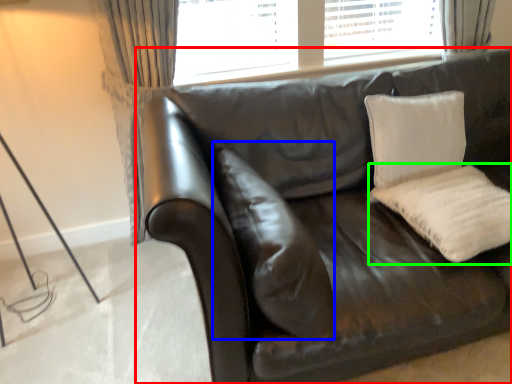
Question: Which is farther away from studio couch (highlighted by a red box)? pillow (highlighted by a blue box) or pillow (highlighted by a green box)?

Choices:
 (A) pillow
 (B) pillow

Answer: (B)